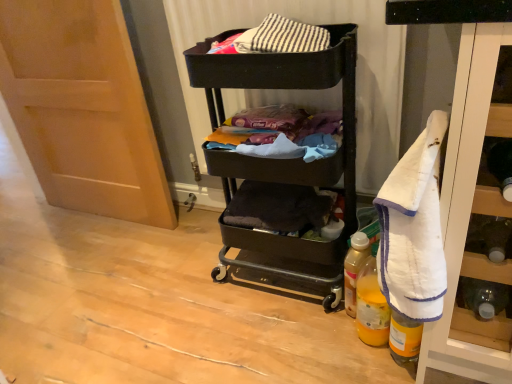
Question: From the image's perspective, would you say matte wood door at left is shown under translucent plastic bottle at lower right, positioned as the 3th bottle in front-to-back order?

Choices:
 (A) no
 (B) yes

Answer: (A)

Question: Could you tell me if matte wood door at left is facing translucent plastic bottle at lower right, positioned as the 3th bottle in front-to-back order?

Choices:
 (A) yes
 (B) no

Answer: (B)

Question: Can you confirm if matte wood door at left is wider than translucent plastic bottle at lower right, positioned as the 3th bottle in front-to-back order?

Choices:
 (A) yes
 (B) no

Answer: (A)

Question: Is matte wood door at left not inside translucent plastic bottle at lower right, positioned as the 3th bottle in front-to-back order?

Choices:
 (A) yes
 (B) no

Answer: (A)

Question: Would you say matte wood door at left contains translucent plastic bottle at lower right, which appears as the first bottle when viewed from the back?

Choices:
 (A) no
 (B) yes

Answer: (A)

Question: Is translucent plastic bottle at lower right, positioned as the 3th bottle in front-to-back order, in front of or behind matte fabric laundry at center in the image?

Choices:
 (A) behind
 (B) front

Answer: (A)

Question: In terms of height, does translucent plastic bottle at lower right, positioned as the 3th bottle in front-to-back order, look taller or shorter compared to matte fabric laundry at center?

Choices:
 (A) short
 (B) tall

Answer: (B)

Question: Considering the relative positions of translucent plastic bottle at lower right, positioned as the 3th bottle in front-to-back order, and matte fabric laundry at center in the image provided, is translucent plastic bottle at lower right, positioned as the 3th bottle in front-to-back order, to the left or to the right of matte fabric laundry at center?

Choices:
 (A) right
 (B) left

Answer: (A)

Question: Looking at the image, does translucent plastic bottle at lower right, which appears as the first bottle when viewed from the back, seem bigger or smaller compared to matte fabric laundry at center?

Choices:
 (A) big
 (B) small

Answer: (B)

Question: Visually, is translucent yellow plastic bottle at lower right, the second bottle when ordered from back to front, positioned to the left or to the right of white terry cloth towel at right?

Choices:
 (A) right
 (B) left

Answer: (B)

Question: From their relative heights in the image, would you say translucent yellow plastic bottle at lower right, which is the 2th bottle in front-to-back order, is taller or shorter than white terry cloth towel at right?

Choices:
 (A) short
 (B) tall

Answer: (A)

Question: In the image, is translucent yellow plastic bottle at lower right, the second bottle when ordered from back to front, positioned in front of or behind white terry cloth towel at right?

Choices:
 (A) front
 (B) behind

Answer: (B)

Question: Is translucent yellow plastic bottle at lower right, the second bottle when ordered from back to front, bigger or smaller than white terry cloth towel at right?

Choices:
 (A) big
 (B) small

Answer: (B)

Question: From a real-world perspective, is translucent plastic bottle at lower right, which appears as the first bottle when viewed from the back, physically located above or below matte wood door at left?

Choices:
 (A) below
 (B) above

Answer: (A)

Question: Considering the positions of point (352, 299) and point (104, 29), is point (352, 299) closer or farther from the camera than point (104, 29)?

Choices:
 (A) closer
 (B) farther

Answer: (A)